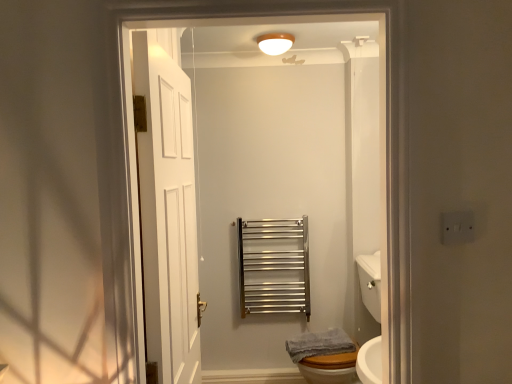
Question: Is satin nickel towel rail at center outside white glossy sink at lower right?

Choices:
 (A) no
 (B) yes

Answer: (B)

Question: Would you consider satin nickel towel rail at center to be distant from white glossy sink at lower right?

Choices:
 (A) yes
 (B) no

Answer: (B)

Question: Is satin nickel towel rail at center taller than white glossy sink at lower right?

Choices:
 (A) no
 (B) yes

Answer: (A)

Question: Is satin nickel towel rail at center thinner than white glossy sink at lower right?

Choices:
 (A) no
 (B) yes

Answer: (B)

Question: Is satin nickel towel rail at center at the left side of white glossy sink at lower right?

Choices:
 (A) no
 (B) yes

Answer: (B)

Question: In the image, is satin nickel towel rail at center on the left side or the right side of white glossy light fixture at upper center?

Choices:
 (A) left
 (B) right

Answer: (B)

Question: In terms of width, does satin nickel towel rail at center look wider or thinner when compared to white glossy light fixture at upper center?

Choices:
 (A) thin
 (B) wide

Answer: (A)

Question: From the image's perspective, is satin nickel towel rail at center positioned above or below white glossy light fixture at upper center?

Choices:
 (A) above
 (B) below

Answer: (B)

Question: Is point (264, 268) positioned closer to the camera than point (285, 49)?

Choices:
 (A) farther
 (B) closer

Answer: (A)

Question: From the image's perspective, is satin nickel towel rail at center above or below white wooden door at center, the first door in the front-to-back sequence?

Choices:
 (A) below
 (B) above

Answer: (A)

Question: From a real-world perspective, is satin nickel towel rail at center positioned above or below white wooden door at center, the second door when ordered from left to right?

Choices:
 (A) below
 (B) above

Answer: (A)

Question: Considering the positions of satin nickel towel rail at center and white wooden door at center, the second door when ordered from left to right, in the image, is satin nickel towel rail at center wider or thinner than white wooden door at center, the second door when ordered from left to right,?

Choices:
 (A) thin
 (B) wide

Answer: (A)

Question: Considering their positions, is satin nickel towel rail at center located in front of or behind white wooden door at center, the first door in the front-to-back sequence?

Choices:
 (A) behind
 (B) front

Answer: (A)

Question: In the image, is white glossy sink at lower right positioned in front of or behind white wooden door at center, which appears as the second door when viewed from the back?

Choices:
 (A) behind
 (B) front

Answer: (A)

Question: Considering the positions of point tap(359, 279) and point tap(384, 233), is point tap(359, 279) closer or farther from the camera than point tap(384, 233)?

Choices:
 (A) farther
 (B) closer

Answer: (A)